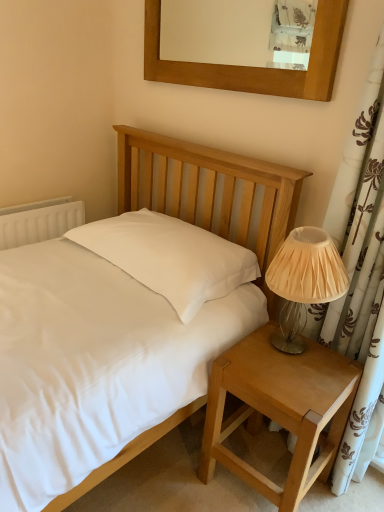
The image size is (384, 512). I want to click on free spot below wooden picture frame at upper center (from a real-world perspective), so [x=230, y=136].